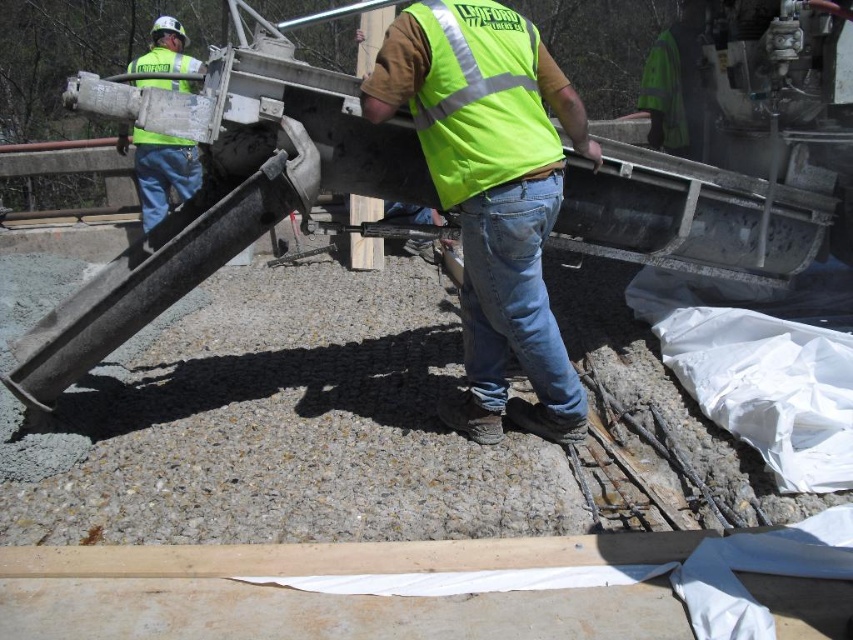
Question: Can you confirm if green reflective vest at upper left is positioned below high visibility yellow-green safety vest at upper left?

Choices:
 (A) no
 (B) yes

Answer: (B)

Question: Estimate the real-world distances between objects in this image. Which object is farther from the high-visibility yellow-green fabric safety vest at center?

Choices:
 (A) high visibility yellow-green safety vest at upper left
 (B) high visibility vest at center
 (C) green reflective vest at upper left

Answer: (C)

Question: Considering the real-world distances, which object is closest to the high visibility yellow-green safety vest at upper left?

Choices:
 (A) high-visibility yellow-green fabric safety vest at center
 (B) high visibility vest at center

Answer: (A)

Question: Which point is closer to the camera taking this photo?

Choices:
 (A) (480, 252)
 (B) (181, 60)
 (C) (517, 60)

Answer: (C)

Question: Can you confirm if high visibility vest at center is positioned to the left of high visibility yellow-green safety vest at upper left?

Choices:
 (A) yes
 (B) no

Answer: (B)

Question: Can you confirm if high-visibility yellow-green fabric safety vest at center is positioned above high visibility yellow-green safety vest at upper left?

Choices:
 (A) no
 (B) yes

Answer: (A)